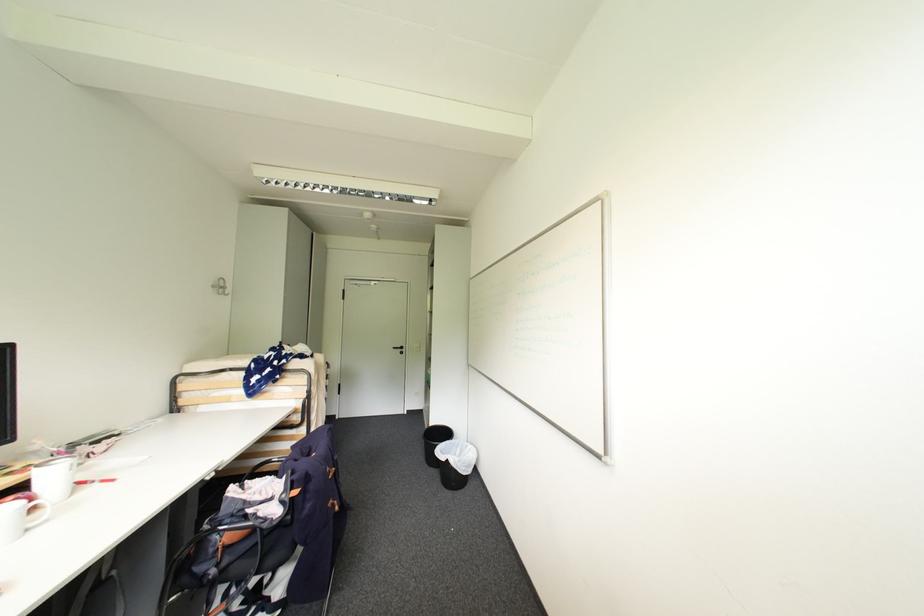
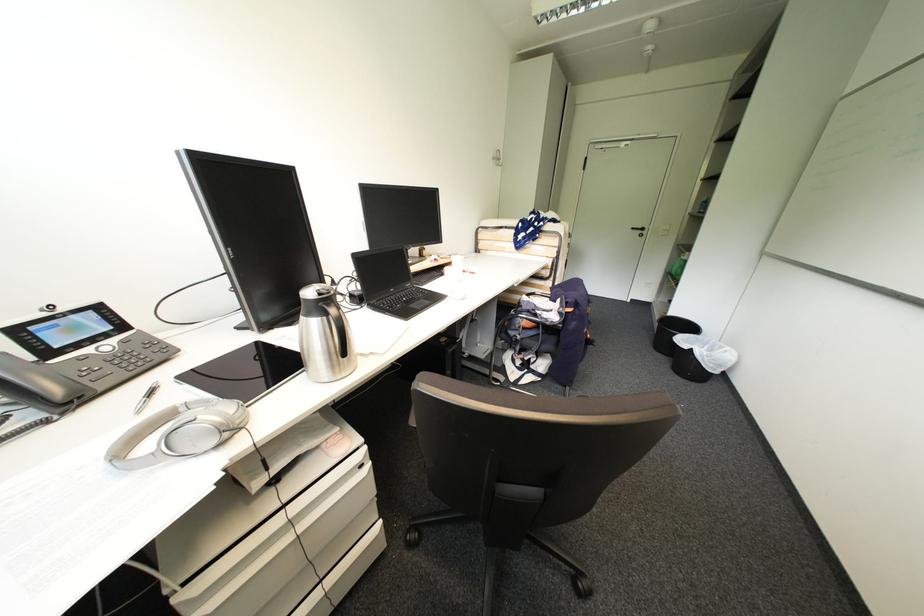
Find the pixel in the second image that matches [35,480] in the first image.

(456, 262)